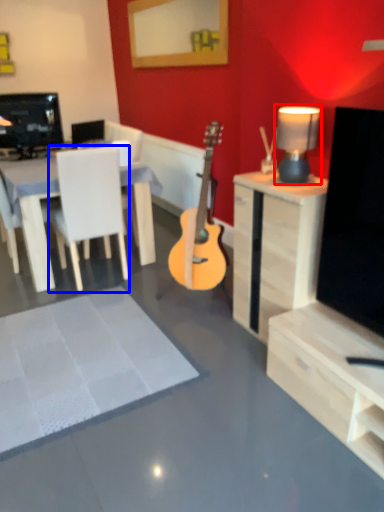
Question: Which point is closer to the camera, lamp (highlighted by a red box) or chair (highlighted by a blue box)?

Choices:
 (A) lamp
 (B) chair

Answer: (A)